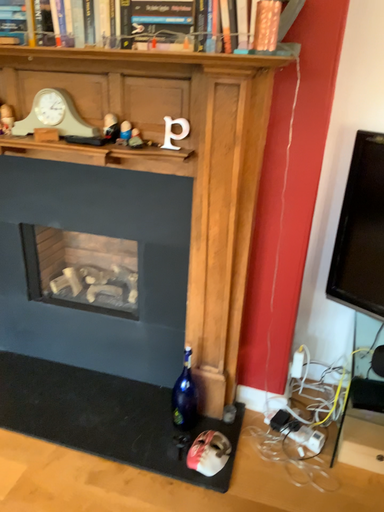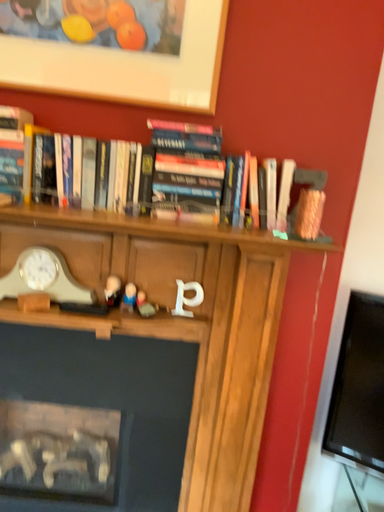
Question: Which way did the camera rotate in the video?

Choices:
 (A) rotated left
 (B) rotated right

Answer: (B)